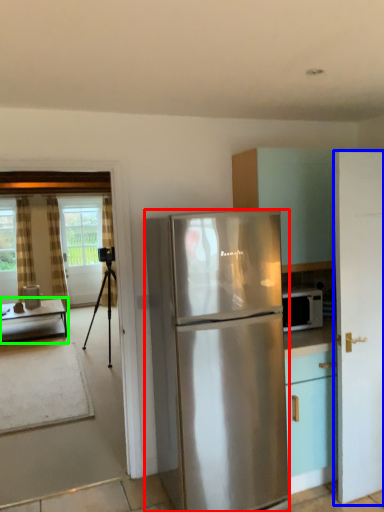
Question: Estimate the real-world distances between objects in this image. Which object is closer to refrigerator (highlighted by a red box), door (highlighted by a blue box) or table (highlighted by a green box)?

Choices:
 (A) door
 (B) table

Answer: (A)